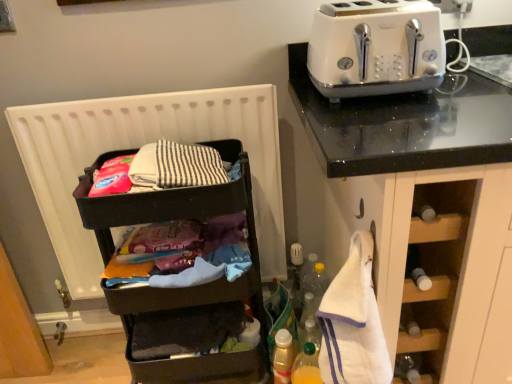
Question: Does white glossy toaster at upper right have a larger size compared to translucent plastic bottle at lower center, placed as the 1th bottle when sorted from left to right?

Choices:
 (A) yes
 (B) no

Answer: (A)

Question: Is white glossy toaster at upper right positioned before translucent plastic bottle at lower center, the second bottle from the right?

Choices:
 (A) no
 (B) yes

Answer: (B)

Question: Considering the relative sizes of white glossy toaster at upper right and translucent plastic bottle at lower center, placed as the 1th bottle when sorted from left to right, in the image provided, is white glossy toaster at upper right shorter than translucent plastic bottle at lower center, placed as the 1th bottle when sorted from left to right,?

Choices:
 (A) yes
 (B) no

Answer: (A)

Question: Can you confirm if white glossy toaster at upper right is smaller than translucent plastic bottle at lower center, placed as the 1th bottle when sorted from left to right?

Choices:
 (A) no
 (B) yes

Answer: (A)

Question: From the image's perspective, is white glossy toaster at upper right located above translucent plastic bottle at lower center, the second bottle from the right?

Choices:
 (A) no
 (B) yes

Answer: (B)

Question: In terms of width, does white glossy toaster at upper right look wider or thinner when compared to white matte radiator at left?

Choices:
 (A) wide
 (B) thin

Answer: (A)

Question: Considering the relative positions of white glossy toaster at upper right and white matte radiator at left in the image provided, is white glossy toaster at upper right to the left or to the right of white matte radiator at left?

Choices:
 (A) right
 (B) left

Answer: (A)

Question: Which is correct: white glossy toaster at upper right is inside white matte radiator at left, or outside of it?

Choices:
 (A) outside
 (B) inside

Answer: (A)

Question: Is point (425, 6) closer or farther from the camera than point (45, 198)?

Choices:
 (A) farther
 (B) closer

Answer: (B)

Question: From a real-world perspective, is black plastic shelf at left positioned above or below white glossy toaster at upper right?

Choices:
 (A) above
 (B) below

Answer: (B)

Question: Considering their positions, is black plastic shelf at left located in front of or behind white glossy toaster at upper right?

Choices:
 (A) front
 (B) behind

Answer: (B)

Question: In the image, is black plastic shelf at left on the left side or the right side of white glossy toaster at upper right?

Choices:
 (A) left
 (B) right

Answer: (A)

Question: From the image's perspective, relative to white glossy toaster at upper right, is black plastic shelf at left above or below?

Choices:
 (A) below
 (B) above

Answer: (A)

Question: Considering the positions of translucent plastic bottle at lower center, the second bottle from the right, and translucent plastic bottle at lower center, the second bottle positioned from the left, in the image, is translucent plastic bottle at lower center, the second bottle from the right, wider or thinner than translucent plastic bottle at lower center, the second bottle positioned from the left,?

Choices:
 (A) wide
 (B) thin

Answer: (A)

Question: Is translucent plastic bottle at lower center, placed as the 1th bottle when sorted from left to right, taller or shorter than translucent plastic bottle at lower center, the first bottle from the right?

Choices:
 (A) tall
 (B) short

Answer: (B)